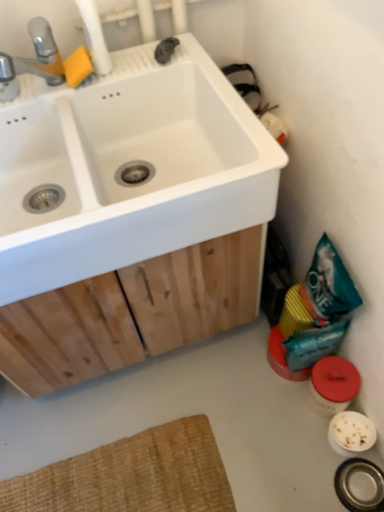
Question: Is teal matte bag at lower right shorter than white matte sink at upper left?

Choices:
 (A) yes
 (B) no

Answer: (A)

Question: Can you confirm if teal matte bag at lower right is bigger than white matte sink at upper left?

Choices:
 (A) yes
 (B) no

Answer: (B)

Question: Is teal matte bag at lower right outside white matte sink at upper left?

Choices:
 (A) no
 (B) yes

Answer: (B)

Question: From the image's perspective, is teal matte bag at lower right over white matte sink at upper left?

Choices:
 (A) no
 (B) yes

Answer: (A)

Question: Does teal matte bag at lower right have a greater width compared to white matte sink at upper left?

Choices:
 (A) no
 (B) yes

Answer: (A)

Question: Does teal matte bag at lower right appear on the left side of white matte sink at upper left?

Choices:
 (A) no
 (B) yes

Answer: (A)

Question: Is white matte sink at upper left bigger than brushed metal faucet at upper left?

Choices:
 (A) yes
 (B) no

Answer: (A)

Question: Would you say white matte sink at upper left is outside brushed metal faucet at upper left?

Choices:
 (A) yes
 (B) no

Answer: (A)

Question: Can you confirm if white matte sink at upper left is shorter than brushed metal faucet at upper left?

Choices:
 (A) yes
 (B) no

Answer: (B)

Question: Does white matte sink at upper left lie behind brushed metal faucet at upper left?

Choices:
 (A) yes
 (B) no

Answer: (B)

Question: From a real-world perspective, is white matte sink at upper left located beneath brushed metal faucet at upper left?

Choices:
 (A) no
 (B) yes

Answer: (B)

Question: From the image's perspective, is white matte sink at upper left above brushed metal faucet at upper left?

Choices:
 (A) no
 (B) yes

Answer: (A)

Question: Considering the relative sizes of teal matte bag at lower right and brushed metal faucet at upper left in the image provided, is teal matte bag at lower right taller than brushed metal faucet at upper left?

Choices:
 (A) no
 (B) yes

Answer: (B)